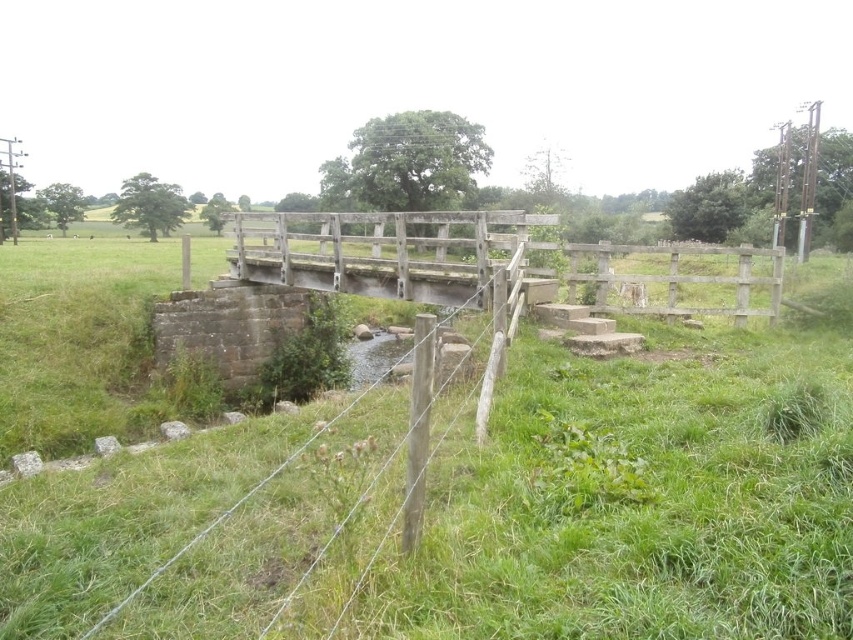
Which is more to the right, green grassy at center or wooden fence at center?

From the viewer's perspective, green grassy at center appears more on the right side.

Which is in front, point (395, 618) or point (462, 292)?

Positioned in front is point (395, 618).

Does point (376, 339) come farther from viewer compared to point (437, 211)?

That is False.

The image size is (853, 640). I want to click on green grassy at center, so click(637, 497).